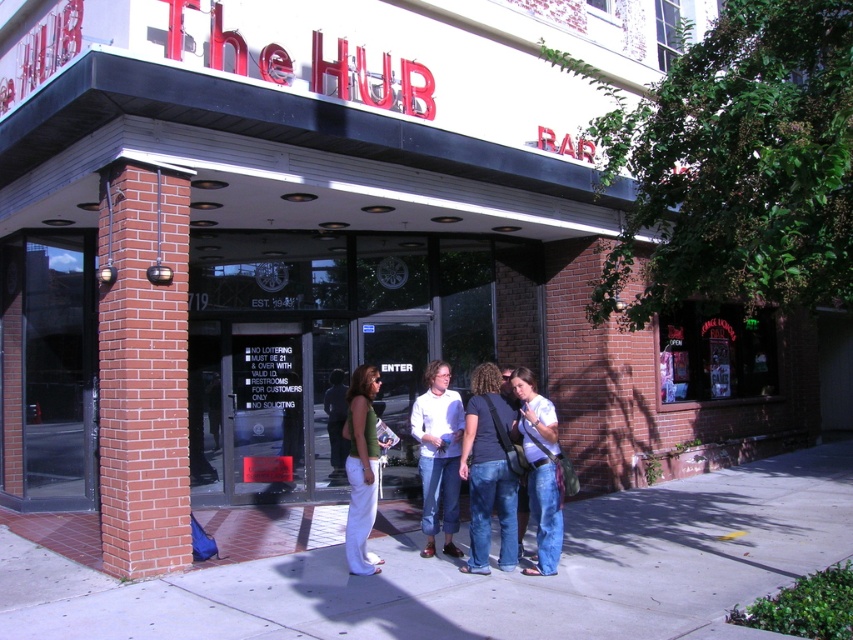
You are standing in front of The Hub Bar and notice both the gray concrete sidewalk at center and the denim jeans at center. Which object is positioned lower from the ground?

The gray concrete sidewalk at center is located below denim jeans at center, so the gray concrete sidewalk at center is lower to the ground than the denim jeans at center.

Based on the photo, what is the spatial relationship between the gray concrete sidewalk at center and the denim jeans at center as seen from the entrance of The Hub Bar?

The gray concrete sidewalk at center is positioned on the right side of denim jeans at center.